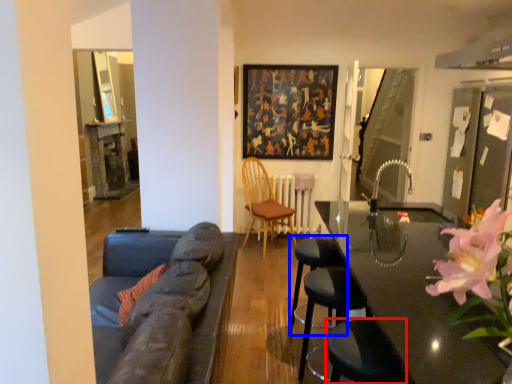
Question: Among these objects, which one is farthest to the camera, swivel chair (highlighted by a red box) or bar stool (highlighted by a blue box)?

Choices:
 (A) swivel chair
 (B) bar stool

Answer: (B)